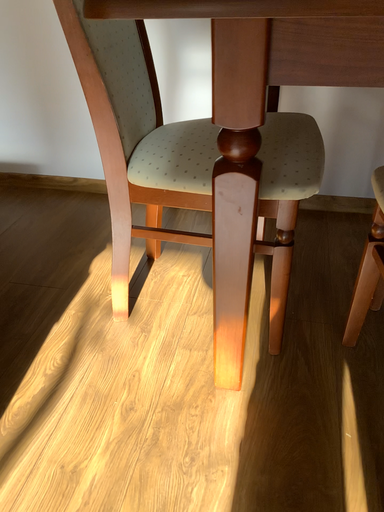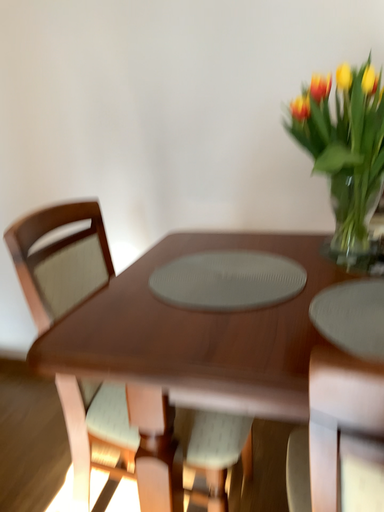
Question: Which way did the camera rotate in the video?

Choices:
 (A) rotated upward
 (B) rotated downward

Answer: (A)